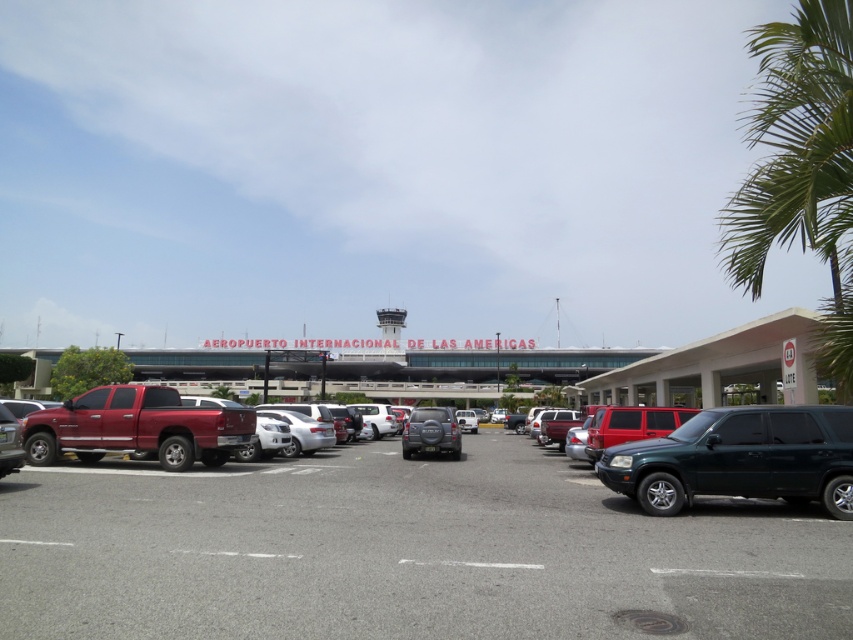
You are standing at the parking lot of Aeropuerto Internacional de Las Americas and want to take a photo of the shiny black suv at right. If your camera can focus on objects up to 10 meters away, will you be able to take a clear photo?

The shiny black suv at right is 9.88 meters away from you, so yes, the camera can focus on it since it is within the 10 meters range.

You are a delivery driver who needs to park your matte red truck at left in the gray asphalt parking lot at center. Based on the scene, will the truck fit vertically in the parking lot space?

The gray asphalt parking lot at center is much taller than the matte red truck at left, so the truck will fit vertically in the parking lot space.